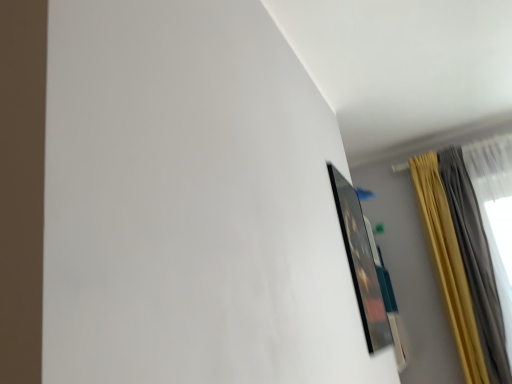
Question: From a real-world perspective, is matte black picture frame at upper right over silky yellow curtain at upper right?

Choices:
 (A) no
 (B) yes

Answer: (A)

Question: From the image's perspective, is matte black picture frame at upper right located above silky yellow curtain at upper right?

Choices:
 (A) yes
 (B) no

Answer: (A)

Question: Considering the relative sizes of matte black picture frame at upper right and silky yellow curtain at upper right in the image provided, is matte black picture frame at upper right thinner than silky yellow curtain at upper right?

Choices:
 (A) yes
 (B) no

Answer: (A)

Question: Considering the relative sizes of matte black picture frame at upper right and silky yellow curtain at upper right in the image provided, is matte black picture frame at upper right wider than silky yellow curtain at upper right?

Choices:
 (A) no
 (B) yes

Answer: (A)

Question: Can you confirm if matte black picture frame at upper right is shorter than silky yellow curtain at upper right?

Choices:
 (A) no
 (B) yes

Answer: (B)

Question: Is matte black picture frame at upper right outside of silky yellow curtain at upper right?

Choices:
 (A) no
 (B) yes

Answer: (B)

Question: Can you confirm if silky yellow curtain at upper right is bigger than matte black picture frame at upper right?

Choices:
 (A) yes
 (B) no

Answer: (A)

Question: From the image's perspective, is silky yellow curtain at upper right over matte black picture frame at upper right?

Choices:
 (A) no
 (B) yes

Answer: (A)

Question: Is silky yellow curtain at upper right thinner than matte black picture frame at upper right?

Choices:
 (A) no
 (B) yes

Answer: (A)

Question: From a real-world perspective, is silky yellow curtain at upper right under matte black picture frame at upper right?

Choices:
 (A) yes
 (B) no

Answer: (B)

Question: Is the position of silky yellow curtain at upper right more distant than that of matte black picture frame at upper right?

Choices:
 (A) yes
 (B) no

Answer: (A)

Question: Would you consider silky yellow curtain at upper right to be distant from matte black picture frame at upper right?

Choices:
 (A) no
 (B) yes

Answer: (B)

Question: In terms of height, does silky yellow curtain at upper right look taller or shorter compared to matte black picture frame at upper right?

Choices:
 (A) tall
 (B) short

Answer: (A)